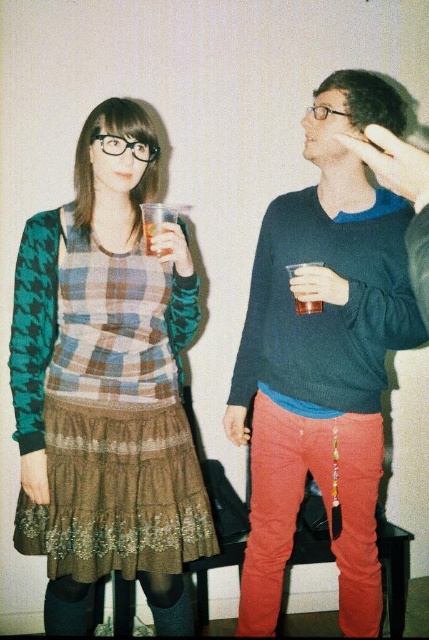
You are an interior designer analyzing the placement of objects in the image. The scene has a plain white wall and two people. You need to determine the exact coordinates of the matte blue sweater at center. What are its coordinates?

The coordinates of the matte blue sweater at center are at point (323,355).